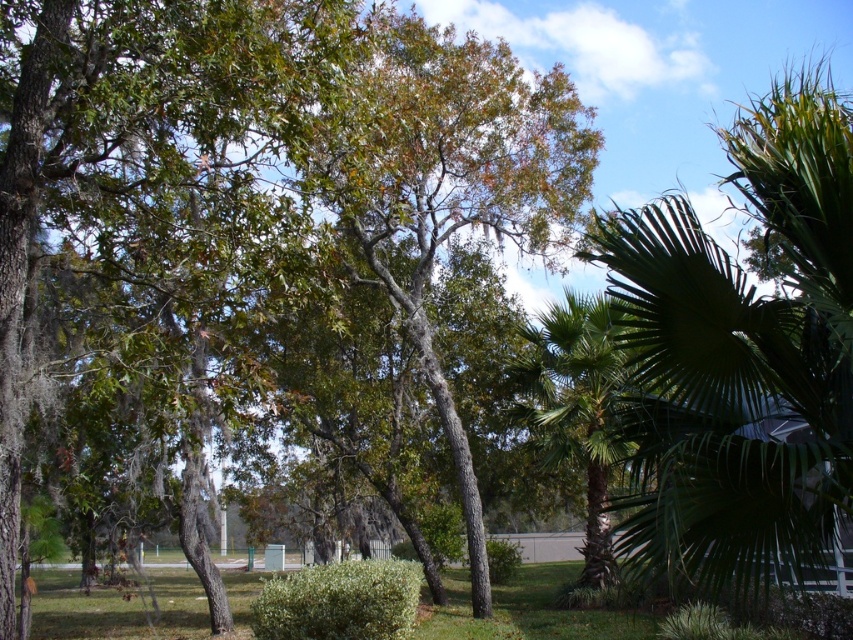
Question: Does green leafy tree at center have a lesser width compared to green grass at lower left?

Choices:
 (A) no
 (B) yes

Answer: (B)

Question: Considering the relative positions of green leafy tree at center and green leafy palm at right in the image provided, where is green leafy tree at center located with respect to green leafy palm at right?

Choices:
 (A) left
 (B) right

Answer: (A)

Question: Is green leafy palm at right positioned behind green leafy palm at center?

Choices:
 (A) yes
 (B) no

Answer: (B)

Question: Among these points, which one is farthest from the camera?

Choices:
 (A) (538, 394)
 (B) (65, 289)

Answer: (A)

Question: Which object appears closest to the camera in this image?

Choices:
 (A) green grass at lower left
 (B) green leafy palm at right
 (C) green leafy palm at center
 (D) green leafy tree at center

Answer: (B)

Question: Considering the real-world distances, which object is farthest from the green leafy palm at right?

Choices:
 (A) green leafy palm at center
 (B) green leafy tree at center

Answer: (B)